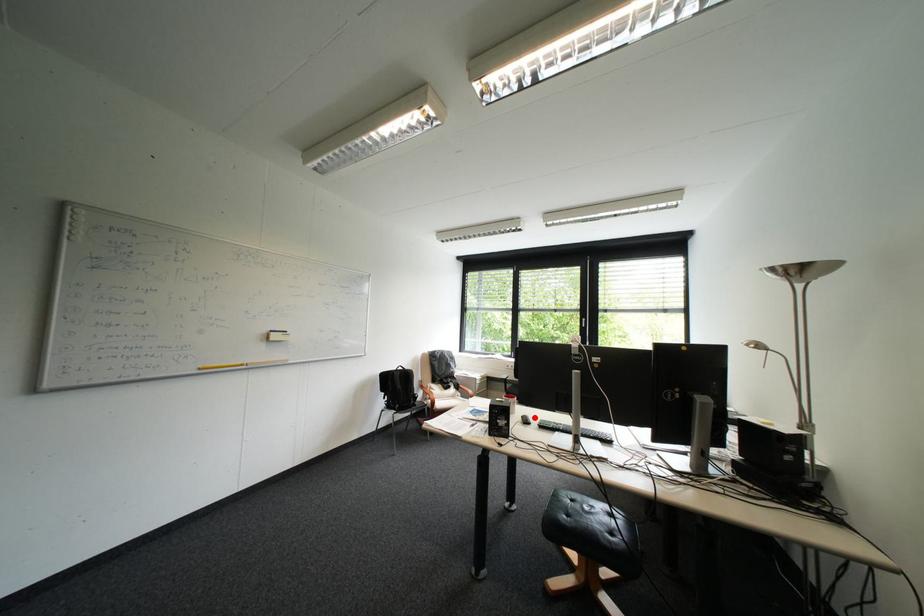
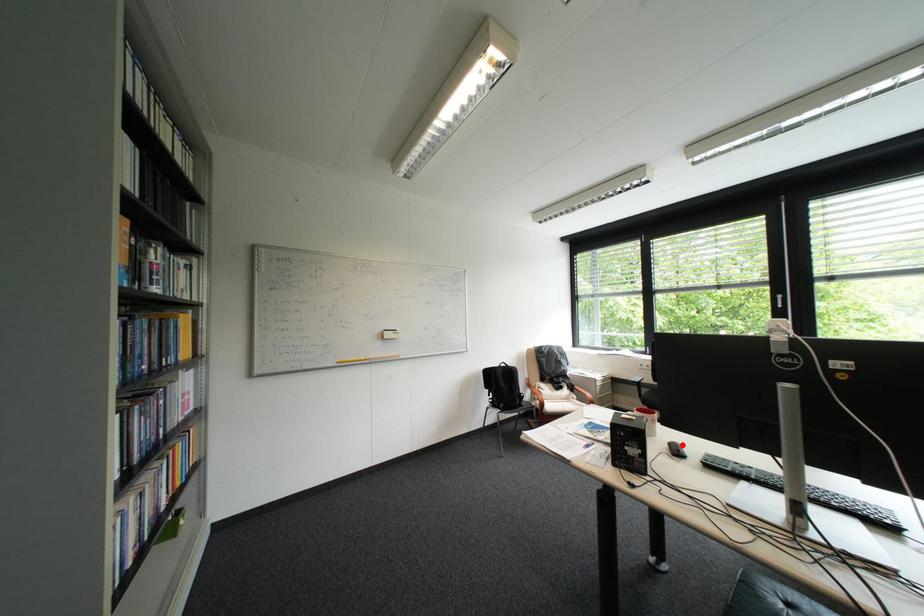
I am providing you with two images of the same scene from different viewpoints. A red point is marked on the first image and another point is marked on the second image. Is the marked point in image1 the same physical position as the marked point in image2?

Yes